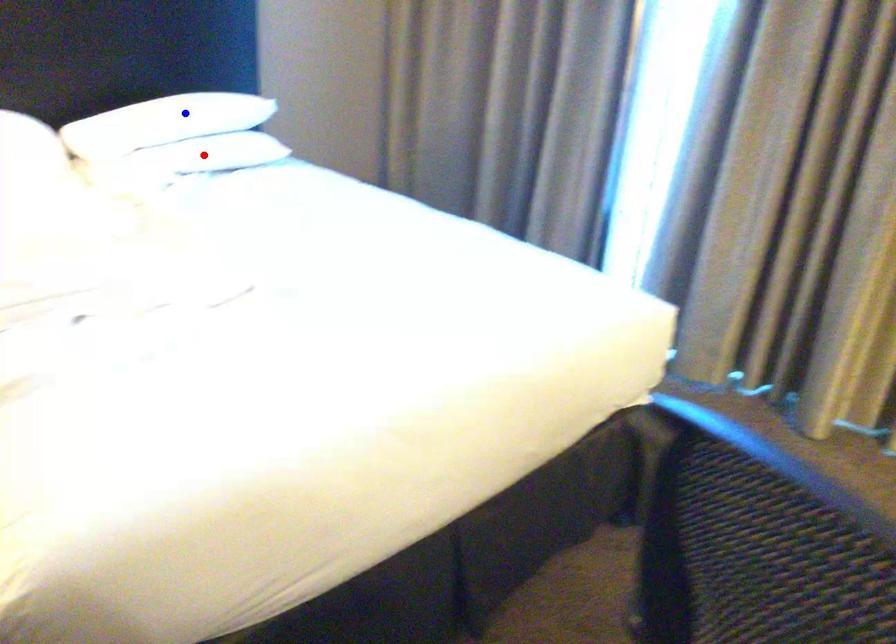
Question: Two points are marked on the image. Which point is closer to the camera?

Choices:
 (A) Blue point is closer.
 (B) Red point is closer.

Answer: (B)